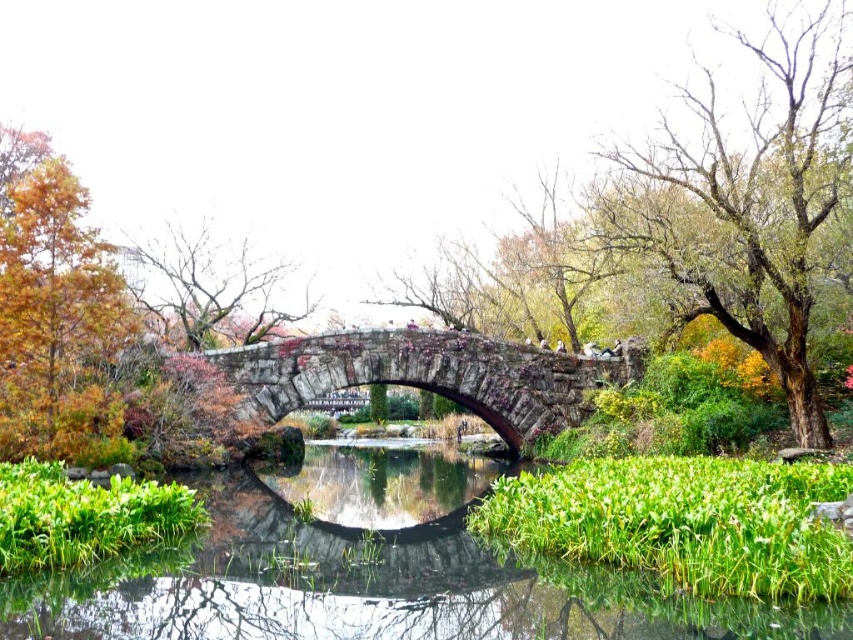
You are standing on the stone bridge and looking towards the trees. Which tree is closer to you, the bare wood tree at upper right or the orange leafy tree at left?

The bare wood tree at upper right is closer to you because it is positioned further to the viewer than the orange leafy tree at left, meaning it appears nearer in your line of sight.

You are standing at the edge of the pond and want to cross to the other side using the rustic stone bridge at center. If your walking speed is 1.2 meters per second, how many seconds will it take you to reach the bridge?

The rustic stone bridge at center is 35.43 meters away from camera. At a walking speed of 1.2 meters per second, it would take approximately 29.5 seconds to reach the bridge.

From the picture: You are a landscape architect designing a new park and want to replicate the scene in the image. You need to place the rustic stone bridge at center and the bare branches at upper left in your design. What is the minimum distance you should keep between them to maintain the same spatial relationship as in the original image?

The rustic stone bridge at center and the bare branches at upper left are 18.13 meters apart in the original image, so the minimum distance should be at least 18.13 meters to maintain the same spatial relationship.